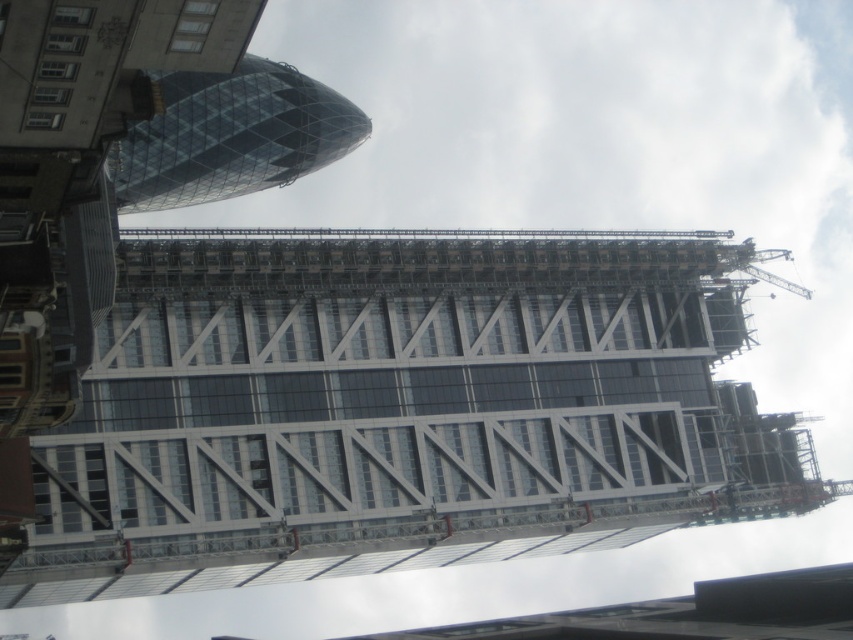
Is transparent glass building at center above transparent glass tower at upper left?

Incorrect, transparent glass building at center is not positioned above transparent glass tower at upper left.

Is transparent glass building at center smaller than transparent glass tower at upper left?

Actually, transparent glass building at center might be larger than transparent glass tower at upper left.

This screenshot has height=640, width=853. Find the location of `transparent glass building at center`. transparent glass building at center is located at coordinates (399, 404).

Identify the location of transparent glass building at center. This screenshot has width=853, height=640. (399, 404).